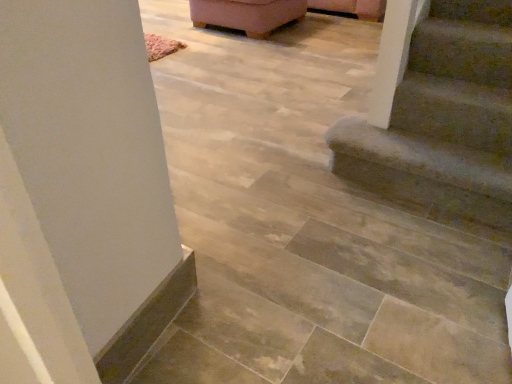
Question: Is pink fabric ottoman at upper center turned away from textured carpet stairs at lower right?

Choices:
 (A) yes
 (B) no

Answer: (B)

Question: Can you confirm if pink fabric ottoman at upper center is taller than textured carpet stairs at lower right?

Choices:
 (A) yes
 (B) no

Answer: (A)

Question: Is pink fabric ottoman at upper center thinner than textured carpet stairs at lower right?

Choices:
 (A) no
 (B) yes

Answer: (A)

Question: Is pink fabric ottoman at upper center bigger than textured carpet stairs at lower right?

Choices:
 (A) yes
 (B) no

Answer: (A)

Question: Considering the relative sizes of pink fabric ottoman at upper center and textured carpet stairs at lower right in the image provided, is pink fabric ottoman at upper center wider than textured carpet stairs at lower right?

Choices:
 (A) no
 (B) yes

Answer: (B)

Question: From the image's perspective, is pink fabric ottoman at upper center under textured carpet stairs at lower right?

Choices:
 (A) no
 (B) yes

Answer: (A)

Question: Is textured carpet stairs at lower right wider than pink fabric ottoman at upper center?

Choices:
 (A) yes
 (B) no

Answer: (B)

Question: Is pink fabric ottoman at upper center completely or partially inside textured carpet stairs at lower right?

Choices:
 (A) yes
 (B) no

Answer: (B)

Question: From a real-world perspective, is textured carpet stairs at lower right positioned under pink fabric ottoman at upper center based on gravity?

Choices:
 (A) yes
 (B) no

Answer: (A)

Question: Is textured carpet stairs at lower right looking in the opposite direction of pink fabric ottoman at upper center?

Choices:
 (A) yes
 (B) no

Answer: (B)

Question: Is textured carpet stairs at lower right at the left side of pink fabric ottoman at upper center?

Choices:
 (A) no
 (B) yes

Answer: (A)

Question: Considering the relative sizes of textured carpet stairs at lower right and pink fabric ottoman at upper center in the image provided, is textured carpet stairs at lower right smaller than pink fabric ottoman at upper center?

Choices:
 (A) no
 (B) yes

Answer: (B)

Question: Is pink fabric ottoman at upper center bigger or smaller than textured carpet stairs at lower right?

Choices:
 (A) big
 (B) small

Answer: (A)